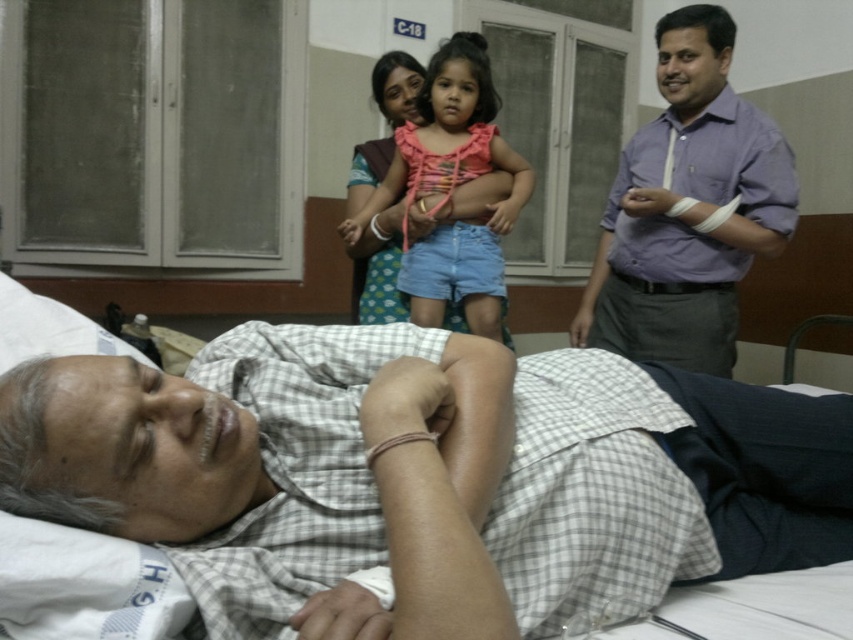
Does point (503, 609) come farther from viewer compared to point (366, 264)?

No, it is in front of (366, 264).

Between checkered fabric shirt at center and brown fabric dress at upper center, which one has more height?

With more height is brown fabric dress at upper center.

Is point (822, 544) positioned in front of point (376, 164)?

Yes, it is in front of point (376, 164).

Identify the location of checkered fabric shirt at center. Image resolution: width=853 pixels, height=640 pixels. (427, 474).

The width and height of the screenshot is (853, 640). What do you see at coordinates (451, 189) in the screenshot? I see `pink fabric dress at center` at bounding box center [451, 189].

Can you confirm if pink fabric dress at center is wider than brown fabric dress at upper center?

Correct, the width of pink fabric dress at center exceeds that of brown fabric dress at upper center.

Between point (404, 221) and point (398, 54), which one is positioned behind?

Point (398, 54)

Identify the location of pink fabric dress at center. (451, 189).

Between purple cotton shirt at right and pink fabric dress at center, which one is positioned lower?

purple cotton shirt at right is lower down.

Is purple cotton shirt at right above pink fabric dress at center?

Actually, purple cotton shirt at right is below pink fabric dress at center.

The image size is (853, 640). Describe the element at coordinates (688, 209) in the screenshot. I see `purple cotton shirt at right` at that location.

This screenshot has width=853, height=640. I want to click on purple cotton shirt at right, so click(688, 209).